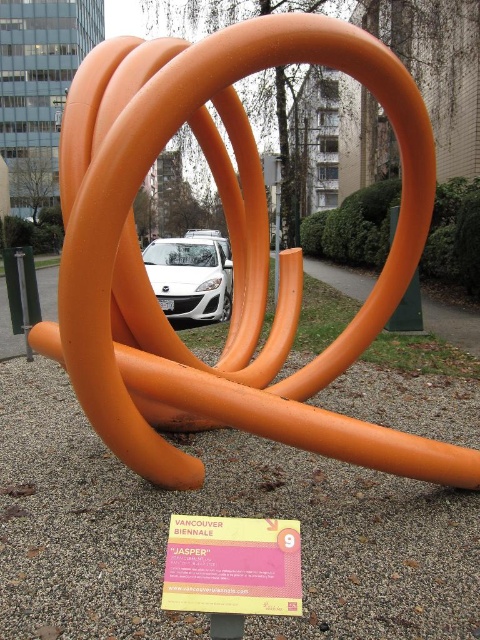
Is orange matte sculpture at center thinner than pink paper at center?

Incorrect, orange matte sculpture at center's width is not less than pink paper at center's.

Describe the element at coordinates (235, 257) in the screenshot. I see `orange matte sculpture at center` at that location.

Image resolution: width=480 pixels, height=640 pixels. I want to click on orange matte sculpture at center, so click(235, 257).

Is pink paper at center wider than white glossy car at center?

Incorrect, pink paper at center's width does not surpass white glossy car at center's.

Can you confirm if pink paper at center is thinner than white glossy car at center?

Correct, pink paper at center's width is less than white glossy car at center's.

Is point (229, 524) positioned before point (216, 282)?

That is True.

I want to click on pink paper at center, so click(232, 564).

Is orange matte sculpture at center wider than white glossy car at center?

Yes, orange matte sculpture at center is wider than white glossy car at center.

Does orange matte sculpture at center appear on the left side of white glossy car at center?

Incorrect, orange matte sculpture at center is not on the left side of white glossy car at center.

Is point (292, 422) positioned after point (168, 260)?

That is False.

I want to click on orange matte sculpture at center, so coord(235,257).